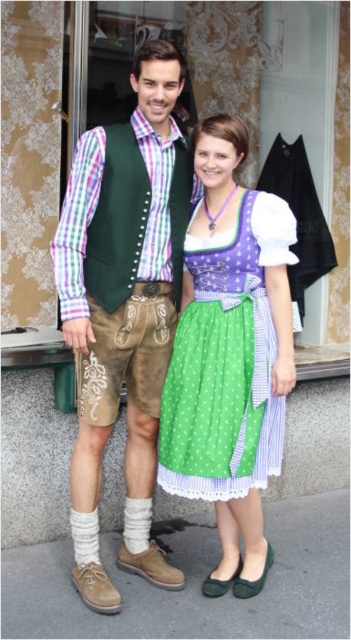
Question: Is leather vest at center positioned behind green polka dot fabric dress at center?

Choices:
 (A) yes
 (B) no

Answer: (B)

Question: Among these points, which one is nearest to the camera?

Choices:
 (A) click(188, 352)
 (B) click(312, 232)

Answer: (A)

Question: Which object is closer to the camera taking this photo?

Choices:
 (A) green polka dot fabric dress at center
 (B) leather vest at center
 (C) matte black apron at center

Answer: (B)

Question: Does green polka dot fabric dress at center have a greater width compared to matte black apron at center?

Choices:
 (A) yes
 (B) no

Answer: (A)

Question: Is green polka dot fabric dress at center to the left of matte black apron at center from the viewer's perspective?

Choices:
 (A) yes
 (B) no

Answer: (A)

Question: Estimate the real-world distances between objects in this image. Which object is closer to the green polka dot fabric dress at center?

Choices:
 (A) matte black apron at center
 (B) leather vest at center

Answer: (B)